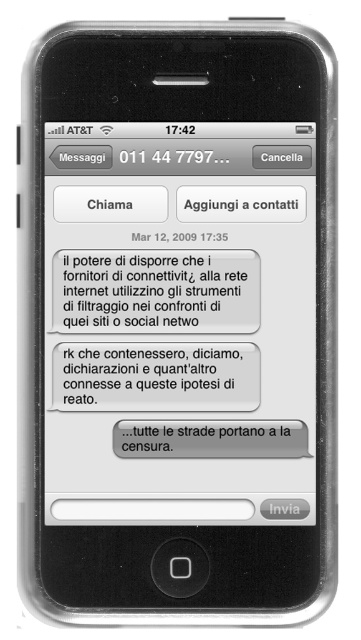
Question: Which point is farther to the camera?

Choices:
 (A) (132, 355)
 (B) (105, 285)
 (C) (193, 456)

Answer: (A)

Question: Does white paper text message at center appear under gray matte text message at center?

Choices:
 (A) yes
 (B) no

Answer: (B)

Question: Considering the relative positions of white paper text at center and gray matte text message at center in the image provided, where is white paper text at center located with respect to gray matte text message at center?

Choices:
 (A) above
 (B) below

Answer: (A)

Question: Which point is closer to the camera?

Choices:
 (A) white paper text message at center
 (B) gray matte text message at center

Answer: (B)

Question: Can you confirm if white paper text message at center is positioned to the left of gray matte text message at center?

Choices:
 (A) no
 (B) yes

Answer: (B)

Question: Which point is closer to the camera taking this photo?

Choices:
 (A) (119, 385)
 (B) (154, 429)
 (C) (224, 276)

Answer: (B)